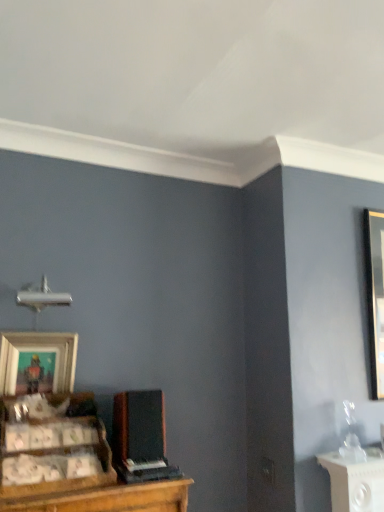
Question: From the image's perspective, is wooden cabinet at lower left beneath wooden picture frame at lower left?

Choices:
 (A) yes
 (B) no

Answer: (A)

Question: Does wooden cabinet at lower left contain wooden picture frame at lower left?

Choices:
 (A) yes
 (B) no

Answer: (B)

Question: Does wooden cabinet at lower left have a greater height compared to wooden picture frame at lower left?

Choices:
 (A) yes
 (B) no

Answer: (B)

Question: Could you tell me if wooden cabinet at lower left is turned towards wooden picture frame at lower left?

Choices:
 (A) no
 (B) yes

Answer: (A)

Question: From a real-world perspective, is wooden cabinet at lower left positioned over wooden picture frame at lower left based on gravity?

Choices:
 (A) no
 (B) yes

Answer: (A)

Question: In terms of height, does wooden picture frame at lower left look taller or shorter compared to wooden cabinet at lower left?

Choices:
 (A) short
 (B) tall

Answer: (B)

Question: Considering the positions of wooden picture frame at lower left and wooden cabinet at lower left in the image, is wooden picture frame at lower left wider or thinner than wooden cabinet at lower left?

Choices:
 (A) wide
 (B) thin

Answer: (B)

Question: Based on their positions, is wooden picture frame at lower left located to the left or right of wooden cabinet at lower left?

Choices:
 (A) right
 (B) left

Answer: (B)

Question: Relative to wooden cabinet at lower left, is wooden picture frame at lower left in front or behind?

Choices:
 (A) behind
 (B) front

Answer: (A)

Question: From their relative heights in the image, would you say wooden cabinet at lower left is taller or shorter than wooden picture frame at lower left?

Choices:
 (A) tall
 (B) short

Answer: (B)

Question: From the image's perspective, is wooden cabinet at lower left positioned above or below wooden picture frame at lower left?

Choices:
 (A) below
 (B) above

Answer: (A)

Question: Is wooden cabinet at lower left to the left or to the right of wooden picture frame at lower left in the image?

Choices:
 (A) right
 (B) left

Answer: (A)

Question: Considering their positions, is wooden cabinet at lower left located in front of or behind wooden picture frame at lower left?

Choices:
 (A) front
 (B) behind

Answer: (A)

Question: Looking at the image, does wooden picture frame at lower left seem bigger or smaller compared to black matte speaker at center?

Choices:
 (A) big
 (B) small

Answer: (B)

Question: Considering the positions of wooden picture frame at lower left and black matte speaker at center in the image, is wooden picture frame at lower left wider or thinner than black matte speaker at center?

Choices:
 (A) wide
 (B) thin

Answer: (B)